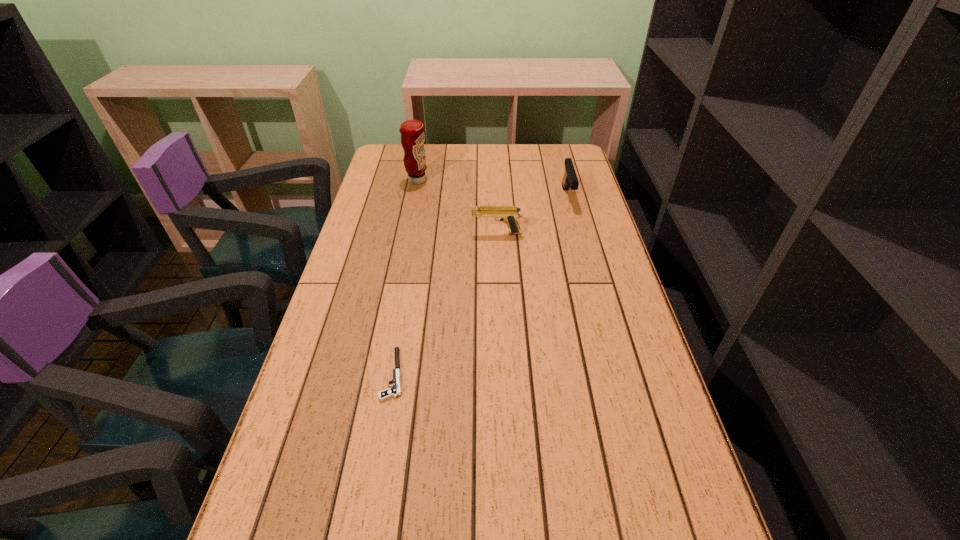
At what (x,y) coordinates should I click in order to perform the action: click on vacant space located at the barrel of the second farthest pistol. Please return your answer as a coordinate pair (x, y). Looking at the image, I should click on (417, 233).

Where is `free space located at the barrel of the second farthest pistol`? free space located at the barrel of the second farthest pistol is located at coordinates (414, 233).

Locate an element on the screen. vacant space positioned 0.120m on the front-facing side of the shortest object is located at coordinates (329, 374).

Locate an element on the screen. This screenshot has width=960, height=540. free region located on the front-facing side of the shortest object is located at coordinates (334, 374).

You are a GUI agent. You are given a task and a screenshot of the screen. Output one action in this format:
    pyautogui.click(x=<x>, y=<y>)
    Task: Click on the free space located on the front-facing side of the shortest object
    This screenshot has height=540, width=960.
    Given the screenshot: What is the action you would take?
    pyautogui.click(x=325, y=374)

The height and width of the screenshot is (540, 960). What are the coordinates of `object present at the far edge` in the screenshot? It's located at (412, 131).

Identify the location of object situated at the left edge. The height and width of the screenshot is (540, 960). (412, 131).

Identify the location of object at the right edge. Image resolution: width=960 pixels, height=540 pixels. (570, 180).

The width and height of the screenshot is (960, 540). In order to click on object located in the far left corner section of the desktop in this screenshot , I will do `click(412, 131)`.

Locate an element on the screen. The height and width of the screenshot is (540, 960). free region at the far edge of the desktop is located at coordinates (516, 173).